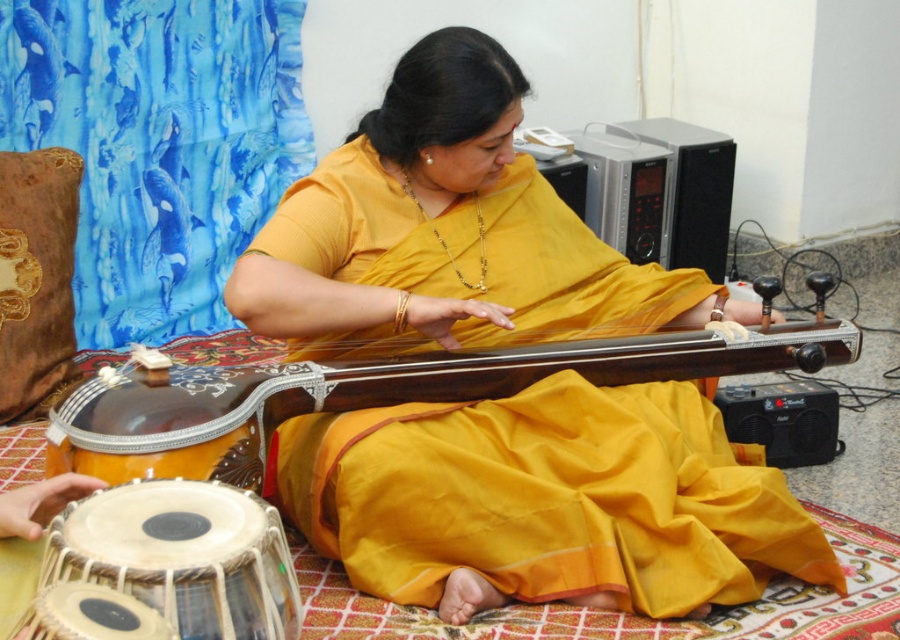
You are a photographer taking a picture of the scene. You want to ensure the matte yellow sari at center and the matte silver drum at lower left are both in the frame. Based on their positions, which object should you position closer to the left side of the camera frame?

The matte silver drum at lower left is to the left of the matte yellow sari at center, so you should position the matte silver drum at lower left closer to the left side of the camera frame.

You are a music teacher preparing a lesson on Indian classical instruments. You have a sitar at center and a point marked at coordinates point (375,392). Can you identify which part of the sitar the point is indicating?

The point (375,392) marks the wooden silver inlay sitar at center.